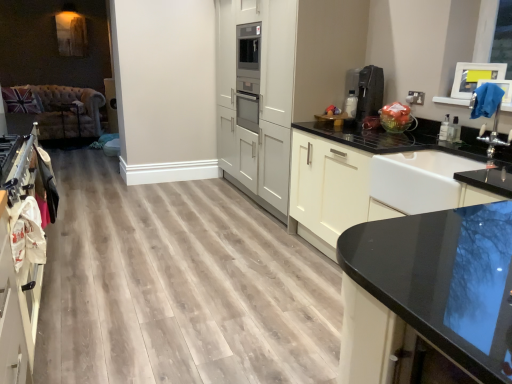
Question: Is point (10, 256) closer or farther from the camera than point (325, 243)?

Choices:
 (A) farther
 (B) closer

Answer: (B)

Question: Looking at their shapes, would you say white matte cabinet at left, the third cabinetry positioned from the right, is wider or thinner than white glossy cabinet at center, the 1th cabinetry in the right-to-left sequence?

Choices:
 (A) wide
 (B) thin

Answer: (B)

Question: Which object is positioned farthest from the white glossy sink at right?

Choices:
 (A) black plastic coffee machine at upper right
 (B) white glossy cabinet at center, the third cabinetry positioned from the left
 (C) white matte cabinet at left, which is the 1th cabinetry from left to right
 (D) black glossy countertop at center
 (E) white matte cabinetry at center, placed as the 2th cabinetry when sorted from left to right

Answer: (C)

Question: Which is nearer to the white glossy cabinet at center, the 1th cabinetry in the right-to-left sequence?

Choices:
 (A) white matte cabinetry at center, arranged as the 2th cabinetry when viewed from the right
 (B) white glossy sink at right
 (C) black plastic coffee machine at upper right
 (D) black glossy countertop at center
 (E) white matte cabinet at left, the third cabinetry positioned from the right

Answer: (B)